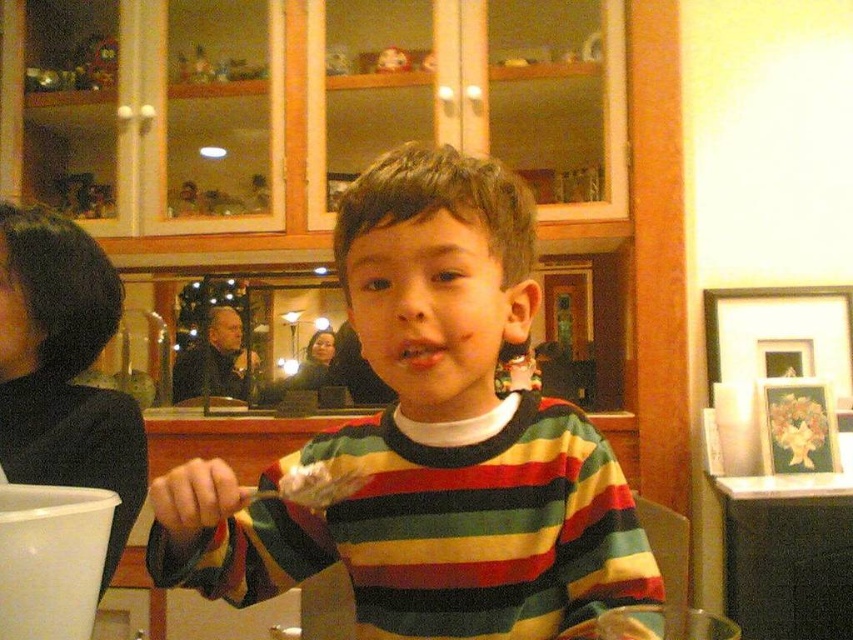
Is striped cotton shirt at center shorter than white creamy food at center?

No.

Is point (451, 579) farther from viewer compared to point (334, 474)?

That is False.

Which is behind, point (474, 548) or point (300, 476)?

Positioned behind is point (474, 548).

Identify the location of striped cotton shirt at center. (430, 442).